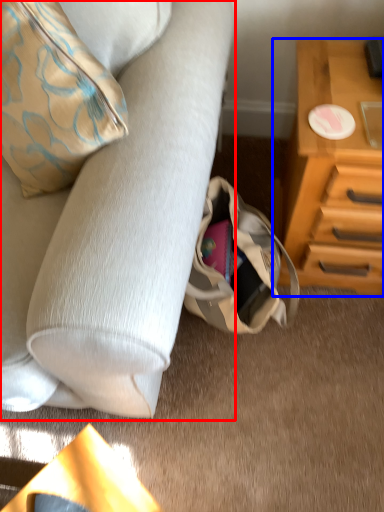
Question: Which of the following is the closest to the observer, studio couch (highlighted by a red box) or chest of drawers (highlighted by a blue box)?

Choices:
 (A) studio couch
 (B) chest of drawers

Answer: (A)